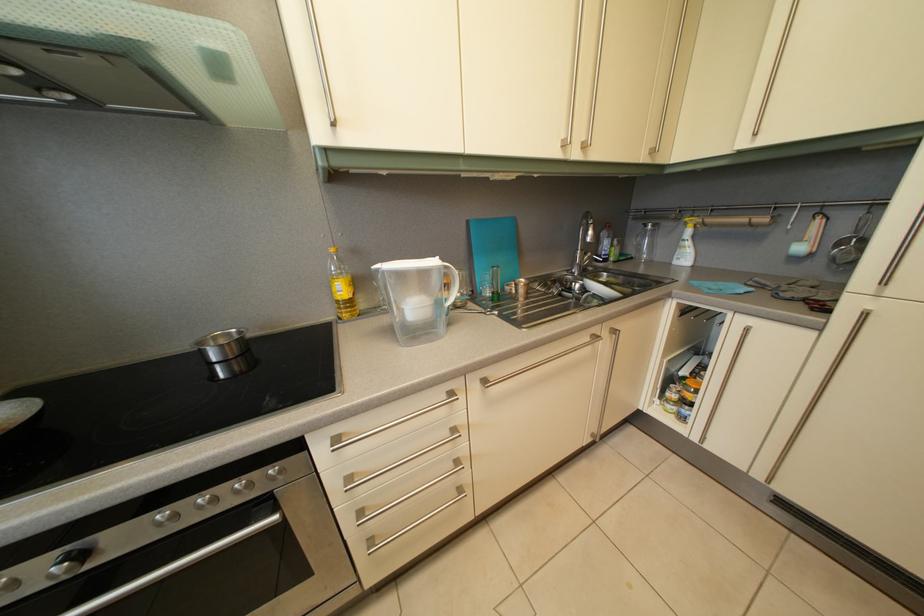
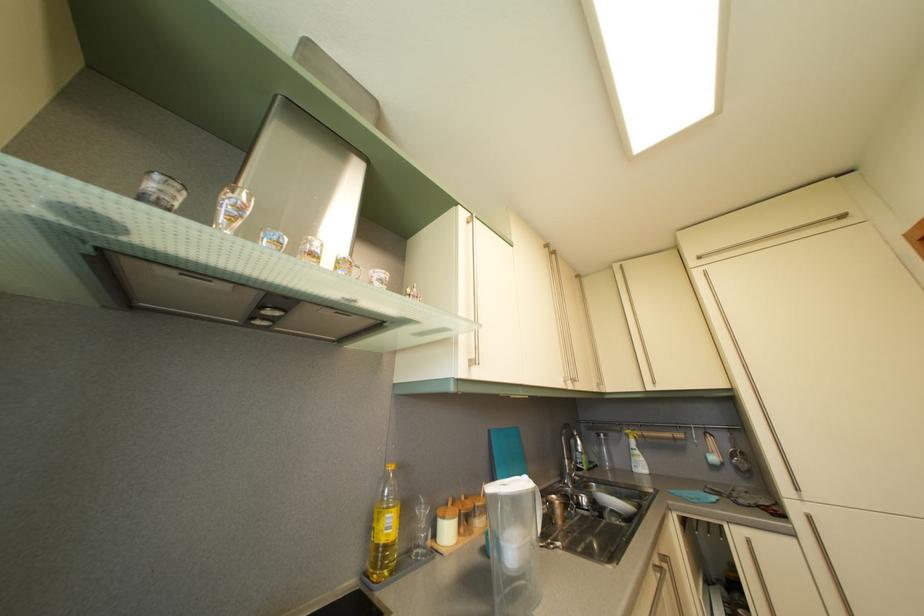
In the second image, find the point that corresponds to point (653, 233) in the first image.

(608, 444)